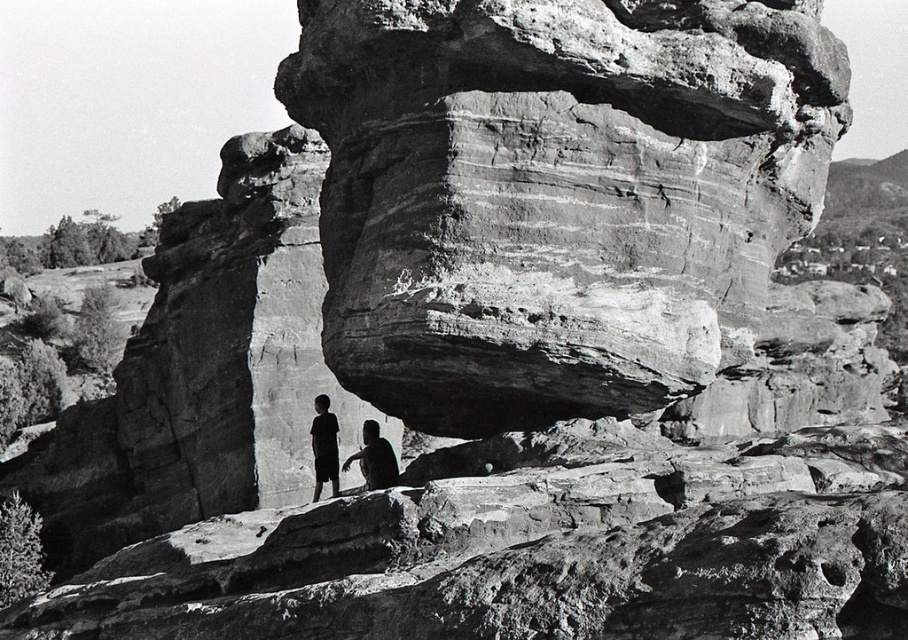
Can you confirm if rugged stone arch at center is positioned above dark skin textured person at lower center?

Correct, rugged stone arch at center is located above dark skin textured person at lower center.

Does rugged stone arch at center appear on the left side of dark skin textured person at lower center?

No, rugged stone arch at center is not to the left of dark skin textured person at lower center.

Is point (385, 124) farther from camera compared to point (319, 486)?

No, (385, 124) is in front of (319, 486).

Find the location of a particular element. rugged stone arch at center is located at coordinates (555, 193).

Is rugged stone arch at center bigger than dark clothing figure at center?

Correct, rugged stone arch at center is larger in size than dark clothing figure at center.

What do you see at coordinates (555, 193) in the screenshot?
I see `rugged stone arch at center` at bounding box center [555, 193].

Where is `rugged stone arch at center`? The height and width of the screenshot is (640, 908). rugged stone arch at center is located at coordinates pos(555,193).

Is point (608, 228) less distant than point (395, 480)?

Yes, point (608, 228) is closer to viewer.

Which is more to the right, rugged stone arch at center or dark skin textured shirt at center?

rugged stone arch at center is more to the right.

Find the location of a particular element. The height and width of the screenshot is (640, 908). rugged stone arch at center is located at coordinates [555, 193].